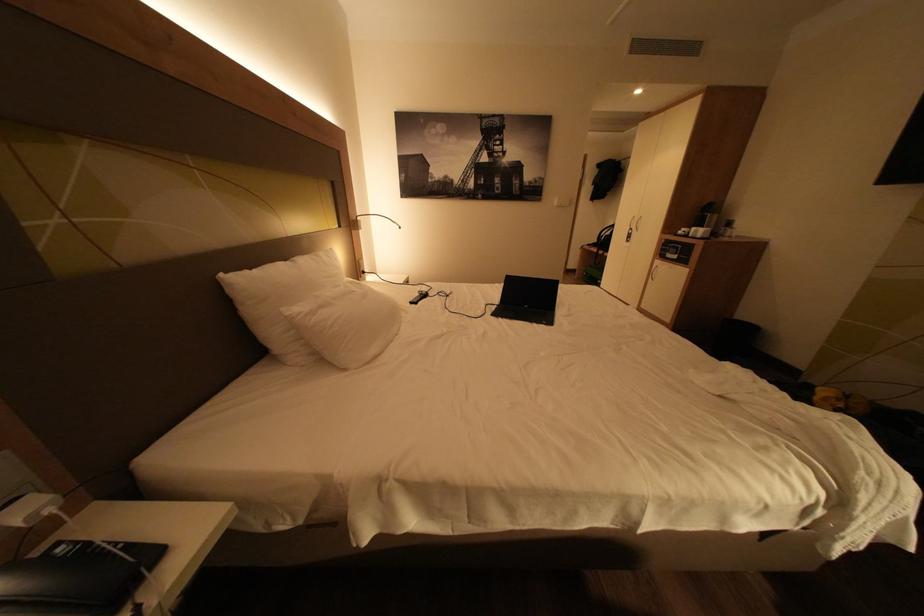
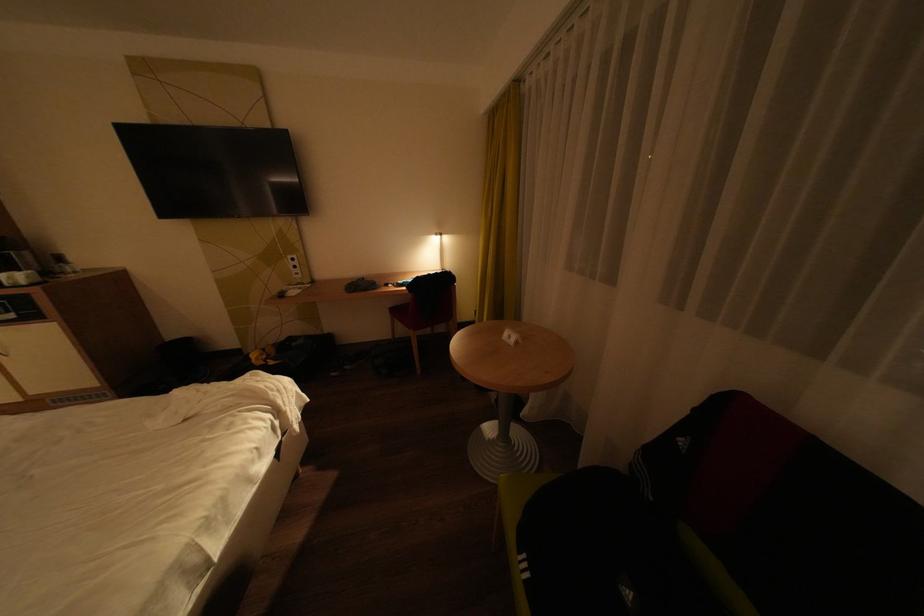
Based on the continuous images, in which direction is the camera rotating?

The camera's rotation is toward right-down.